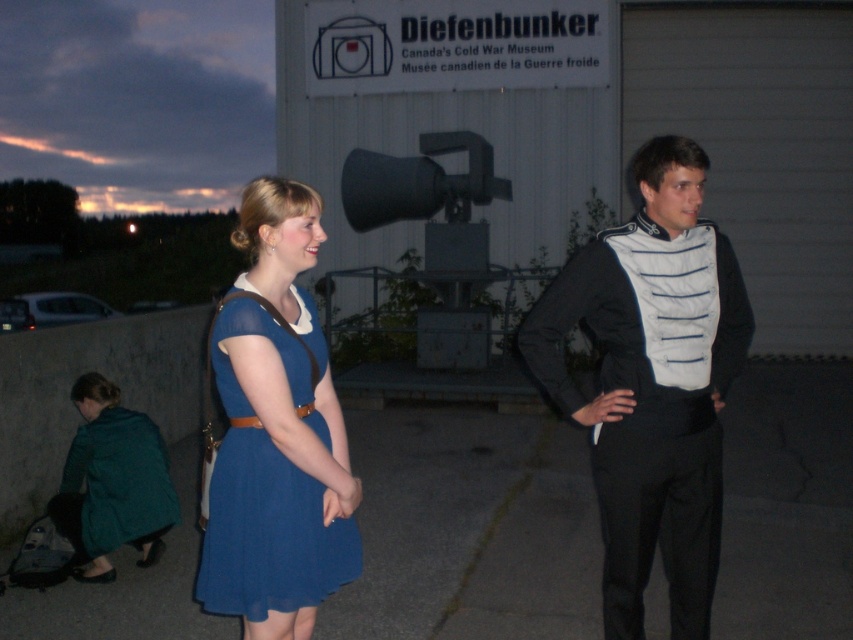
You are a photographer setting up a shot of the two people in front of the Diefenbunker sign. To ensure both the matte blue dress at center and the teal fabric coat at lower left are in frame, which object should you position closer to the left side of your camera viewfinder?

The teal fabric coat at lower left should be positioned closer to the left side of the camera viewfinder since it is already located to the left of the matte blue dress at center.

You are a photographer trying to capture a photo of the two people in the scene. Since you want to highlight both the black fabric vest at center and the matte blue dress at center, which one should be placed to the right in your photo composition?

The black fabric vest at center is positioned on the right side of matte blue dress at center, so to highlight both in your photo composition, the black fabric vest at center should be placed to the right of the matte blue dress at center.

What is located at the coordinates point (270, 483)?

The location at point (270, 483) contains the matte blue dress at center.